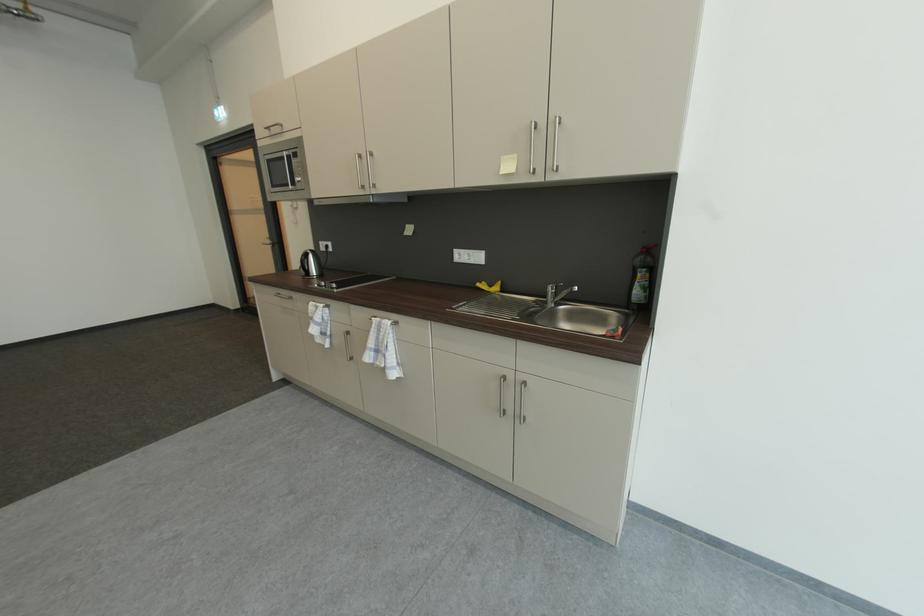
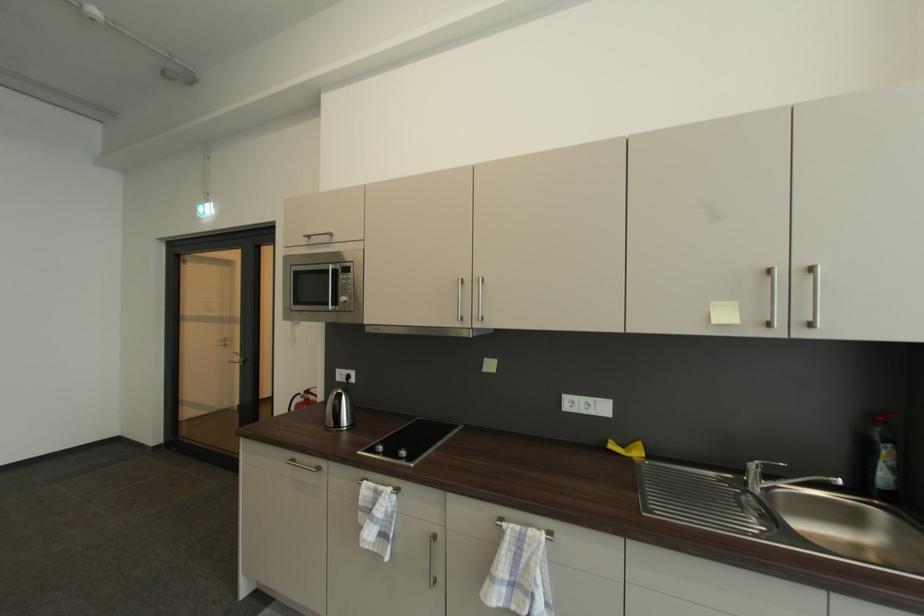
In the second image, find the point that corresponds to point (378, 322) in the first image.

(507, 529)